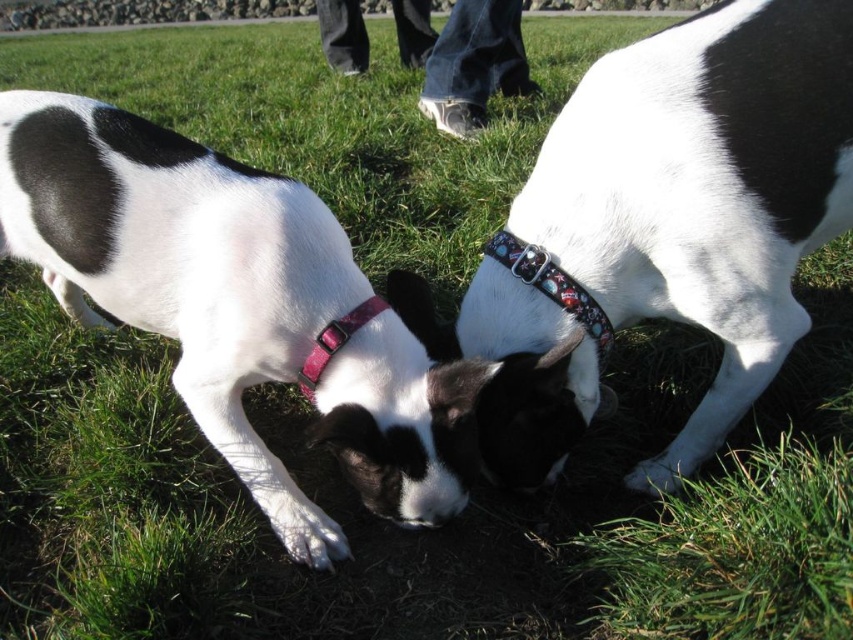
Who is more distant from viewer, (679,476) or (496,248)?

Positioned behind is point (679,476).

Does point (619, 131) lie behind point (500, 248)?

That is False.

The image size is (853, 640). Identify the location of white fabric collar at center. (703, 189).

Which of these two, white fabric collar at center or pink fabric collar at center, stands shorter?

pink fabric collar at center is shorter.

Does point (821, 108) come behind point (305, 388)?

No, it is not.

Where is `white fabric collar at center`? Image resolution: width=853 pixels, height=640 pixels. white fabric collar at center is located at coordinates (703, 189).

Which of these two, white fabric collar at center or white matte dog at center, stands taller?

white matte dog at center

What are the coordinates of `white fabric collar at center` in the screenshot? It's located at (703, 189).

You are a GUI agent. You are given a task and a screenshot of the screen. Output one action in this format:
    pyautogui.click(x=<x>, y=<y>)
    Task: Click on the white fabric collar at center
    The image size is (853, 640).
    Given the screenshot: What is the action you would take?
    pyautogui.click(x=703, y=189)